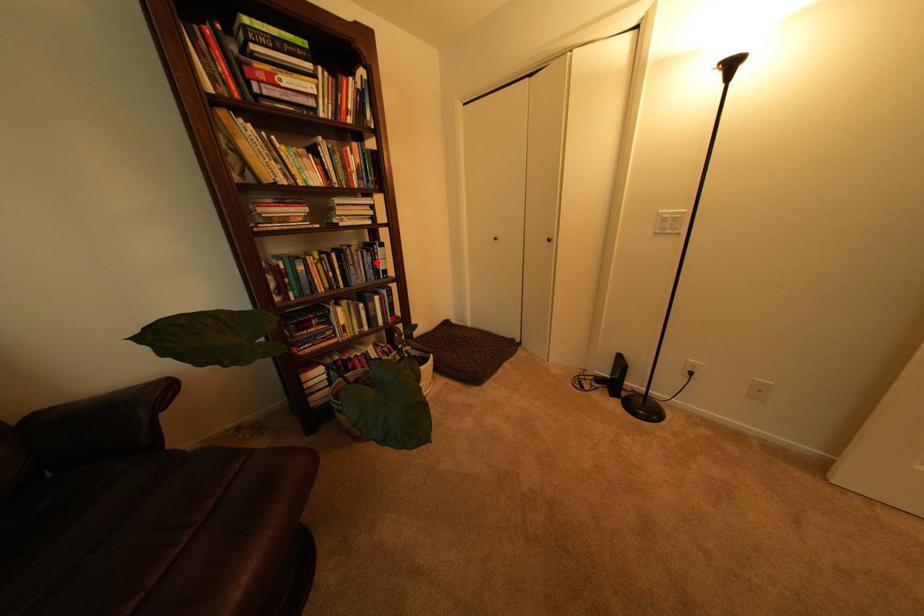
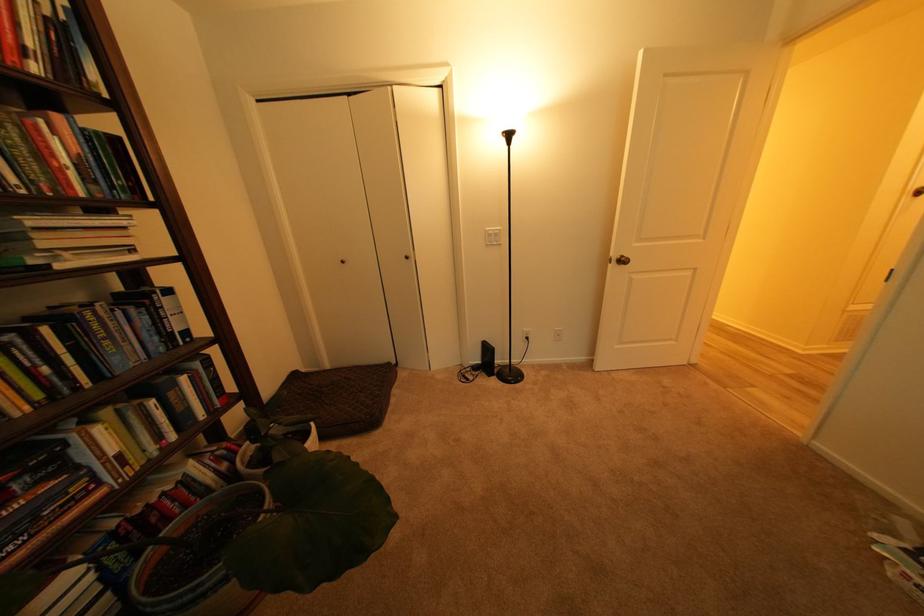
Question: A red point is marked in image1. In image2, is the corresponding 3D point closer to the camera or farther? Reply with the corresponding letter.

Choices:
 (A) The corresponding 3D point is closer.
 (B) The corresponding 3D point is farther.

Answer: (B)